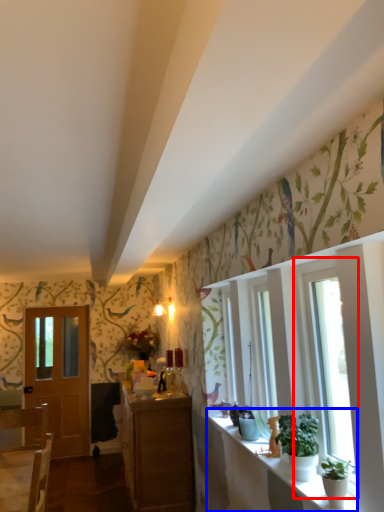
Question: Which object appears closest to the camera in this image, window (highlighted by a red box) or window sill (highlighted by a blue box)?

Choices:
 (A) window
 (B) window sill

Answer: (B)